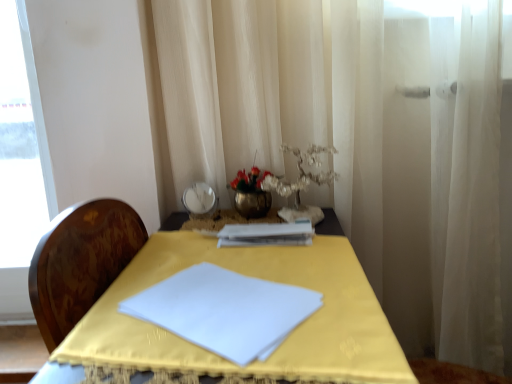
The width and height of the screenshot is (512, 384). Find the location of `unoccupied region to the right of matte silver bowl at upper center`. unoccupied region to the right of matte silver bowl at upper center is located at coordinates (242, 218).